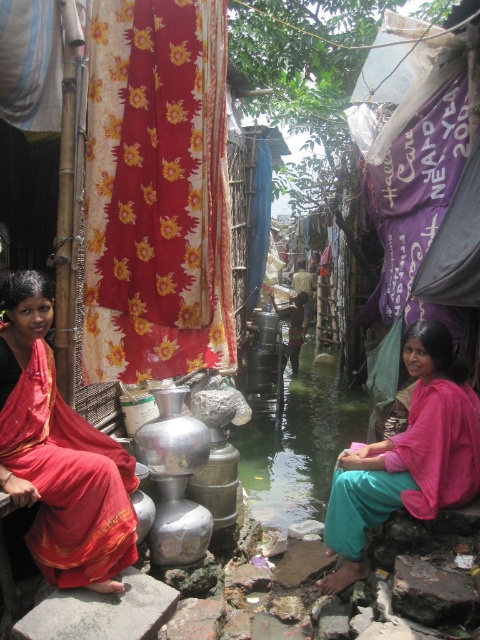
You are a delivery person trying to navigate through the narrow alleyway. You see the floral fabric curtain at upper left and the pink fabric at lower right. Which fabric is larger in size?

The pink fabric at lower right is larger than the floral fabric curtain at upper left.

You are a delivery person in the alleyway and need to carry a package that is 2 meters wide. You see the matte red sari at left and the pink fabric at lower right. Which one of these can you use to wrap the package without needing to fold it?

The pink fabric at lower right has a width greater than the matte red sari at left. Since the package is 2 meters wide, the pink fabric at lower right is wider and can wrap the package without folding.

You are standing in the alleyway and see the point marked at coordinates (x=156, y=192). What object is this point located on?

The point is located on the floral fabric curtain at upper left.